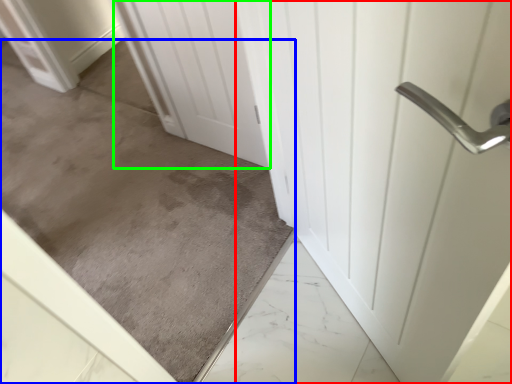
Question: Which is farther away from door (highlighted by a red box)? concrete (highlighted by a blue box) or door (highlighted by a green box)?

Choices:
 (A) concrete
 (B) door

Answer: (A)